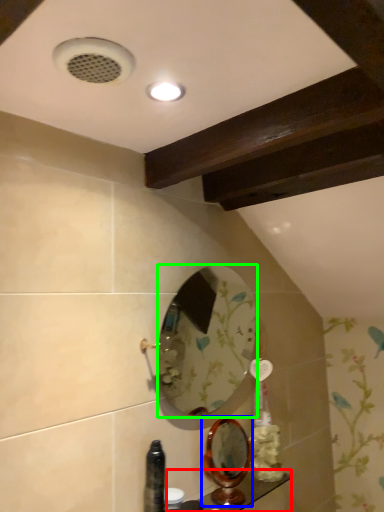
Question: Which object is positioned closest to counter top (highlighted by a red box)? Select from mirror (highlighted by a blue box) and mirror (highlighted by a green box).

Choices:
 (A) mirror
 (B) mirror

Answer: (A)